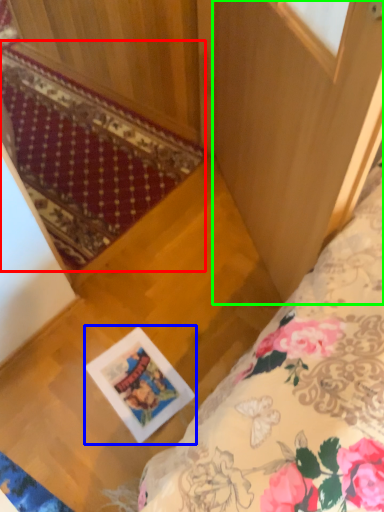
Question: Estimate the real-world distances between objects in this image. Which object is farther from mat (highlighted by a red box), picture frame (highlighted by a blue box) or screen door (highlighted by a green box)?

Choices:
 (A) picture frame
 (B) screen door

Answer: (A)